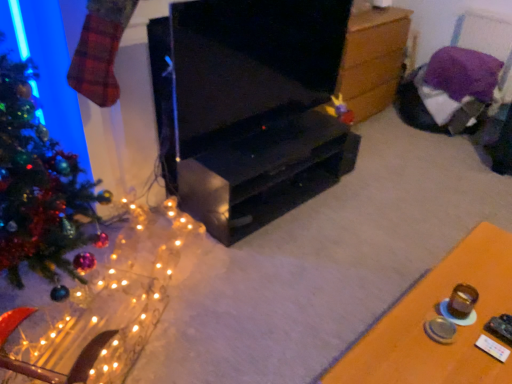
Locate an element on the screen. unoccupied region to the right of illuminated wire mesh at left is located at coordinates (249, 298).